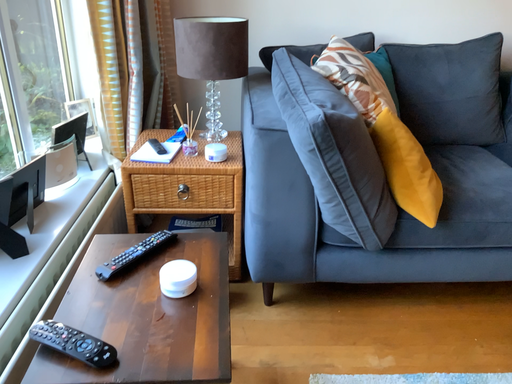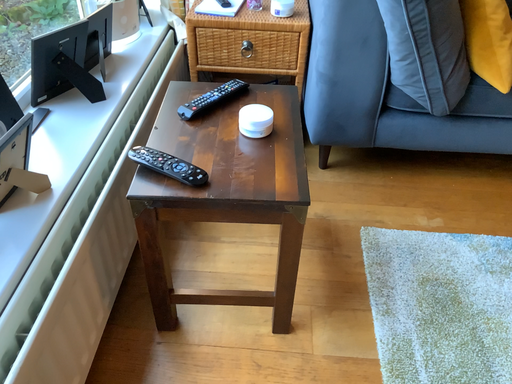
Question: Which way did the camera rotate in the video?

Choices:
 (A) rotated upward
 (B) rotated downward

Answer: (B)